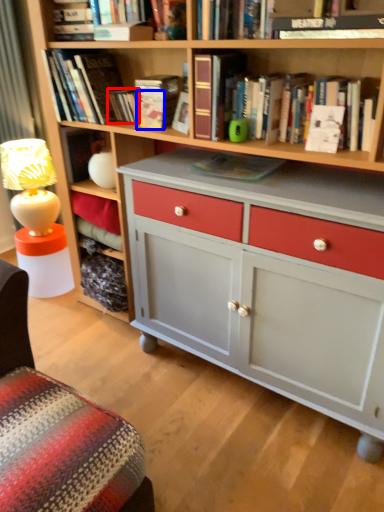
Question: Which object appears closest to the camera in this image, paperback book (highlighted by a red box) or paperback book (highlighted by a blue box)?

Choices:
 (A) paperback book
 (B) paperback book

Answer: (B)